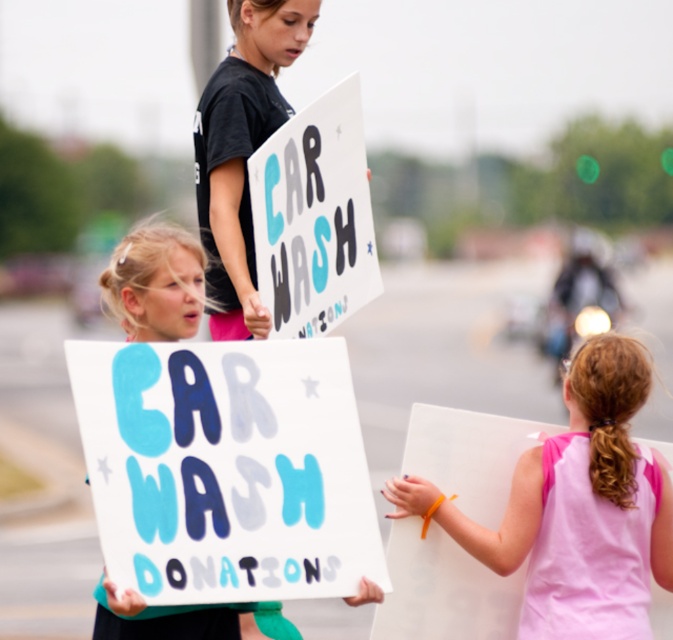
Question: Which of these objects is positioned farthest from the pink fabric sign at right?

Choices:
 (A) hand-painted cardboard sign at upper center
 (B) hand-painted cardboard sign at center

Answer: (A)

Question: Can you confirm if pink fabric sign at right is positioned below hand-painted cardboard sign at upper center?

Choices:
 (A) no
 (B) yes

Answer: (B)

Question: Observing the image, what is the correct spatial positioning of hand-painted cardboard sign at center in reference to hand-painted cardboard sign at upper center?

Choices:
 (A) right
 (B) left

Answer: (B)

Question: Which object appears closest to the camera in this image?

Choices:
 (A) pink fabric sign at right
 (B) hand-painted cardboard sign at center

Answer: (B)

Question: Can you confirm if pink fabric sign at right is positioned below hand-painted cardboard sign at upper center?

Choices:
 (A) no
 (B) yes

Answer: (B)

Question: Which point is farther to the camera?

Choices:
 (A) (334, 413)
 (B) (330, 314)

Answer: (B)